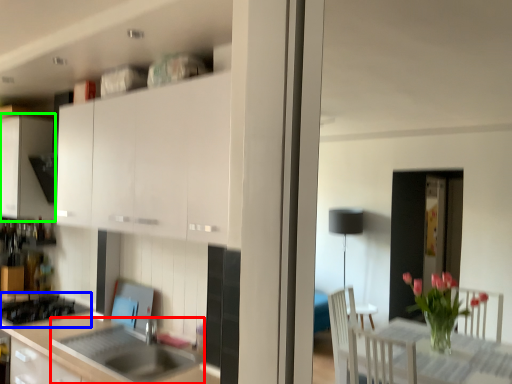
Question: Which object is the closest to the sink (highlighted by a red box)? Choose among these: gas stove (highlighted by a blue box) or cabinetry (highlighted by a green box).

Choices:
 (A) gas stove
 (B) cabinetry

Answer: (A)